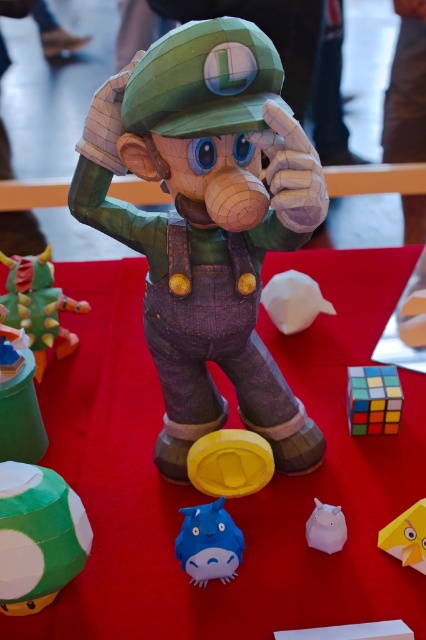
Is matte brown paper luigi at center below yellow paper toy at center?

No.

Does matte brown paper luigi at center have a larger size compared to yellow paper toy at center?

Yes.

Does point (311, 218) come behind point (402, 554)?

No, it is not.

What are the coordinates of `matte brown paper luigi at center` in the screenshot? It's located at (207, 224).

Does yellow matte coin at center have a lesser height compared to matte white plush at center?

Incorrect, yellow matte coin at center's height does not fall short of matte white plush at center's.

Who is shorter, yellow matte coin at center or matte white plush at center?

matte white plush at center

Between point (261, 486) and point (313, 538), which one is positioned behind?

The point (261, 486) is behind.

Locate an element on the screen. The width and height of the screenshot is (426, 640). yellow matte coin at center is located at coordinates (x=230, y=461).

Is point (71, 550) positioned behind point (224, 572)?

No, it is not.

Between green paper mushroom at lower left and blue matte plush toy at center, which one is positioned lower?

blue matte plush toy at center

Is point (60, 529) farther from viewer compared to point (238, 547)?

No, it is in front of (238, 547).

Find the location of a particular element. green paper mushroom at lower left is located at coordinates (37, 536).